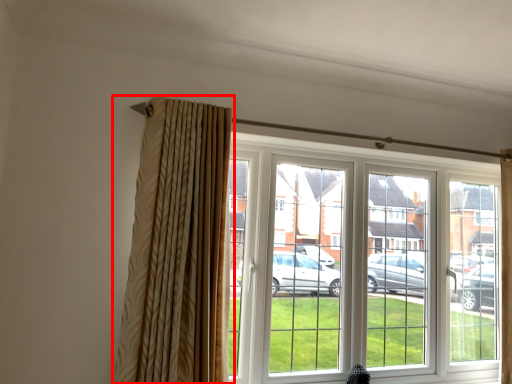
Question: From the image's perspective, where is curtain (annotated by the red box) located in relation to window in the image?

Choices:
 (A) above
 (B) below

Answer: (A)